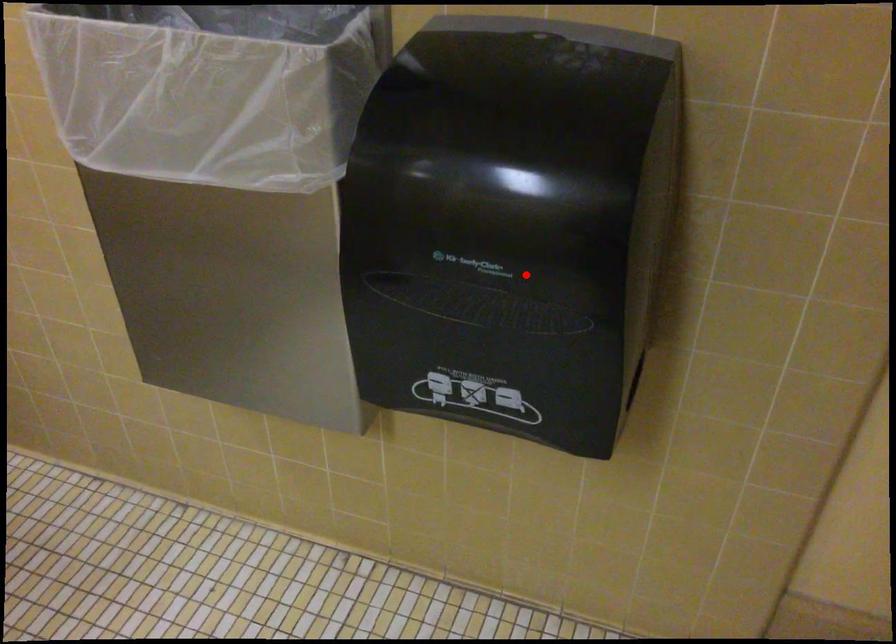
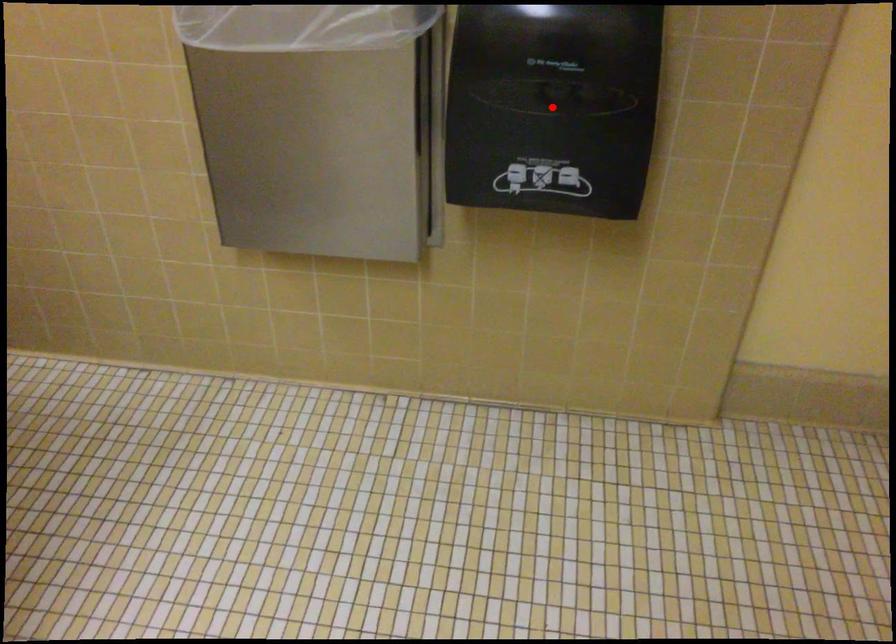
Based on the photo, I am providing you with two images of the same scene from different viewpoints. A red point is marked on the first image and another point is marked on the second image. Is the marked point in image1 the same physical position as the marked point in image2?

Yes